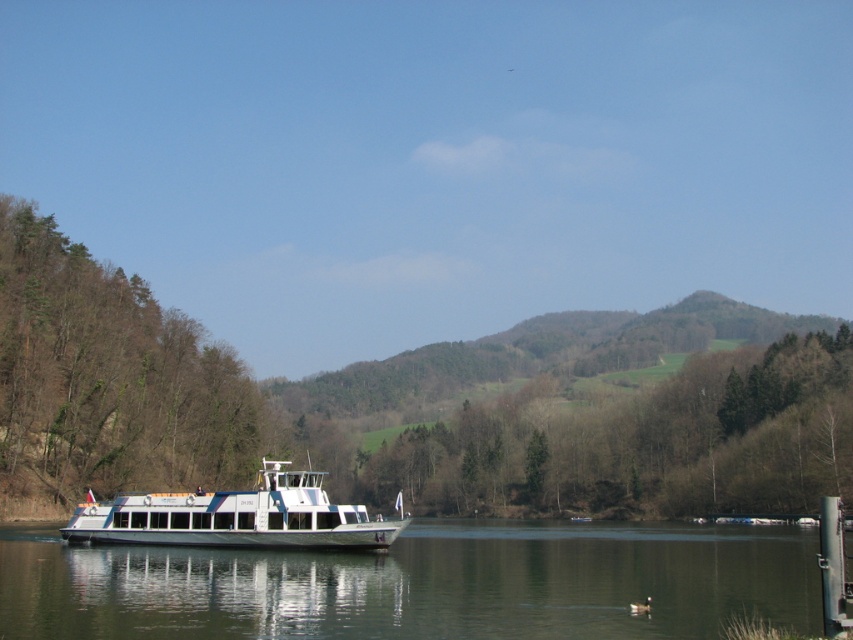
Measure the distance between point (680, 627) and camera.

They are 33.41 meters apart.

Who is more forward, (144, 557) or (814, 428)?

Point (144, 557) is more forward.

This screenshot has width=853, height=640. I want to click on green reflective water at lower center, so click(x=418, y=584).

In the scene shown: Between green leafy tree at center and green leafy tree at left, which one has more height?

green leafy tree at center is taller.

Which is more to the right, green leafy tree at center or green leafy tree at left?

green leafy tree at center is more to the right.

Is point (42, 342) in front of point (21, 272)?

That is True.

Identify the location of green leafy tree at center. (418, 403).

How far apart are green leafy trees at center and white glossy boat at center?

A distance of 433.03 feet exists between green leafy trees at center and white glossy boat at center.

Which of these two, green leafy trees at center or white glossy boat at center, stands taller?

green leafy trees at center

Identify the location of green leafy trees at center. (641, 442).